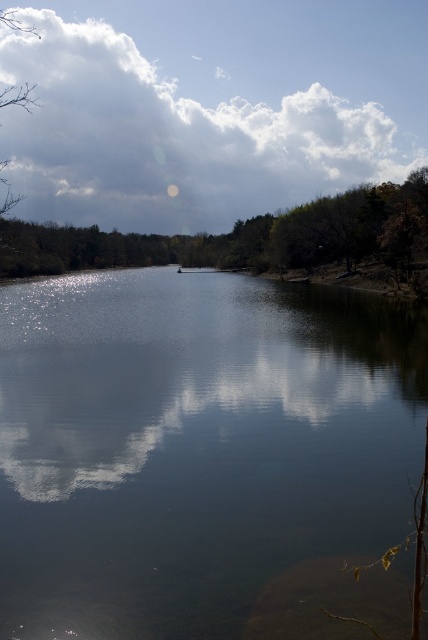
Question: Based on their relative distances, which object is nearer to the clear water at center?

Choices:
 (A) green matte tree at upper center
 (B) white fluffy cloud at upper center

Answer: (A)

Question: Which is farther from the clear water at center?

Choices:
 (A) white fluffy cloud at upper center
 (B) green matte tree at upper center

Answer: (A)

Question: Is clear water at center above green matte tree at upper center?

Choices:
 (A) yes
 (B) no

Answer: (B)

Question: Does white fluffy cloud at upper center have a greater width compared to green matte tree at upper center?

Choices:
 (A) yes
 (B) no

Answer: (A)

Question: Which of the following is the farthest from the observer?

Choices:
 (A) (383, 257)
 (B) (374, 164)

Answer: (B)

Question: Does clear water at center have a larger size compared to white fluffy cloud at upper center?

Choices:
 (A) yes
 (B) no

Answer: (B)